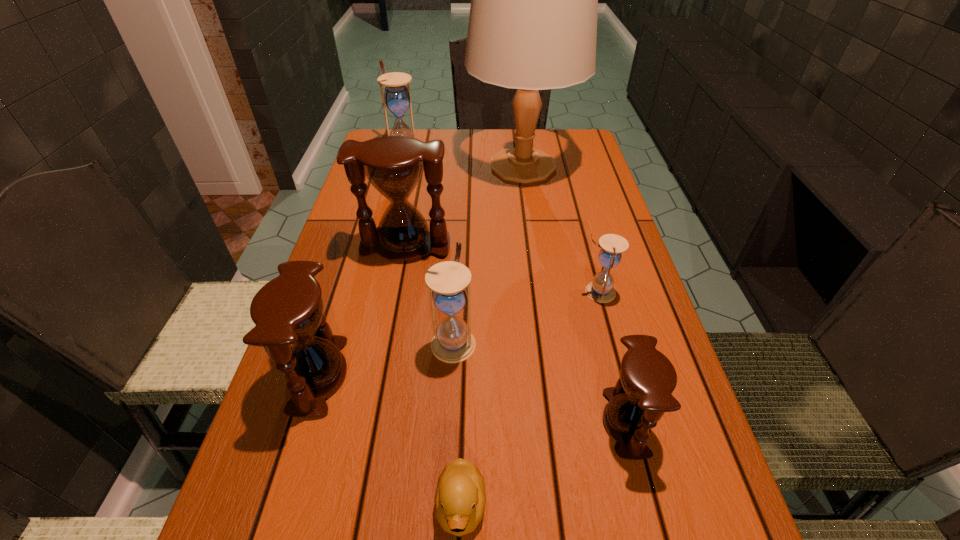
Identify the location of free space that is in between the biggest brown hourglass and the rightmost brown hourglass. (516, 335).

The width and height of the screenshot is (960, 540). Find the location of `vacant area that lies between the tallest object and the rightmost brown hourglass`. vacant area that lies between the tallest object and the rightmost brown hourglass is located at coordinates (574, 294).

Identify the location of vacant area that lies between the rightmost brown hourglass and the farthest hourglass. (x=515, y=287).

This screenshot has height=540, width=960. In order to click on blank region between the second biggest white hourglass and the second smallest brown hourglass in this screenshot , I will do `click(386, 359)`.

What are the coordinates of `object that stands as the third closest to the shortest object` in the screenshot? It's located at (643, 393).

Identify which object is located as the fourth nearest to the third farthest object. Please provide its 2D coordinates. Your answer should be formatted as a tuple, i.e. [(x, y)], where the tuple contains the x and y coordinates of a point satisfying the conditions above.

[(601, 290)]

I want to click on hourglass identified as the fourth closest to the second biggest brown hourglass, so click(x=601, y=290).

Point out which hourglass is positioned as the nearest to the shortest object. Please provide its 2D coordinates. Your answer should be formatted as a tuple, i.e. [(x, y)], where the tuple contains the x and y coordinates of a point satisfying the conditions above.

[(287, 310)]

Locate which white hourglass is the third closest to the smallest brown hourglass. Please provide its 2D coordinates. Your answer should be formatted as a tuple, i.e. [(x, y)], where the tuple contains the x and y coordinates of a point satisfying the conditions above.

[(396, 97)]

You are a GUI agent. You are given a task and a screenshot of the screen. Output one action in this format:
    pyautogui.click(x=<x>, y=<y>)
    Task: Click on the white hourglass that is the second closest to the rightmost brown hourglass
    Image resolution: width=960 pixels, height=540 pixels.
    Given the screenshot: What is the action you would take?
    pyautogui.click(x=453, y=342)